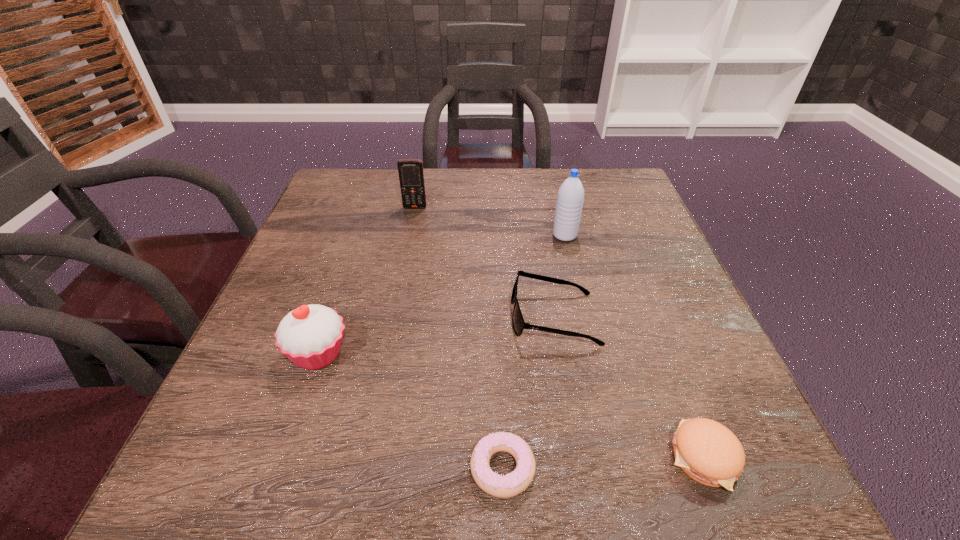
I want to click on doughnut positioned at the near edge, so click(x=512, y=484).

At what (x,y) coordinates should I click in order to perform the action: click on object that is at the left edge. Please return your answer as a coordinate pair (x, y). This screenshot has width=960, height=540. Looking at the image, I should click on (310, 336).

This screenshot has height=540, width=960. What are the coordinates of `object that is at the right edge` in the screenshot? It's located at (707, 451).

Locate an element on the screen. The width and height of the screenshot is (960, 540). object that is at the near right corner is located at coordinates point(707,451).

Image resolution: width=960 pixels, height=540 pixels. Find the location of `vacant space at the far edge of the desktop`. vacant space at the far edge of the desktop is located at coordinates (508, 204).

This screenshot has width=960, height=540. In the image, there is a desktop. What are the coordinates of `vacant area at the near edge` in the screenshot? It's located at (543, 494).

This screenshot has height=540, width=960. I want to click on vacant region at the left edge of the desktop, so click(x=279, y=416).

At what (x,y) coordinates should I click in order to perform the action: click on free space at the right edge of the desktop. Please return your answer as a coordinate pair (x, y). Looking at the image, I should click on (670, 276).

This screenshot has width=960, height=540. In order to click on blank space at the far left corner of the desktop in this screenshot , I will do `click(384, 174)`.

Find the location of `vacant position at the far right corner of the desktop`. vacant position at the far right corner of the desktop is located at coordinates (583, 170).